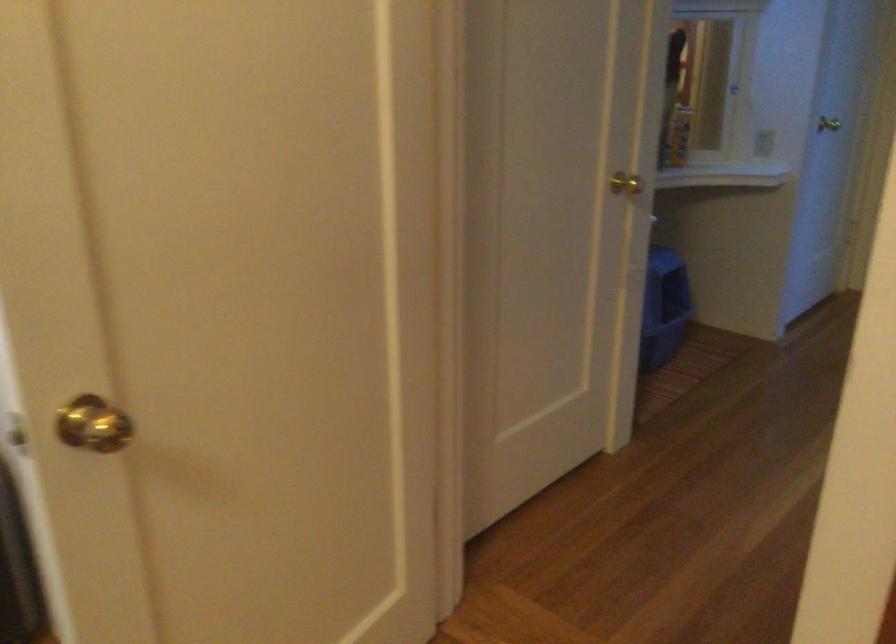
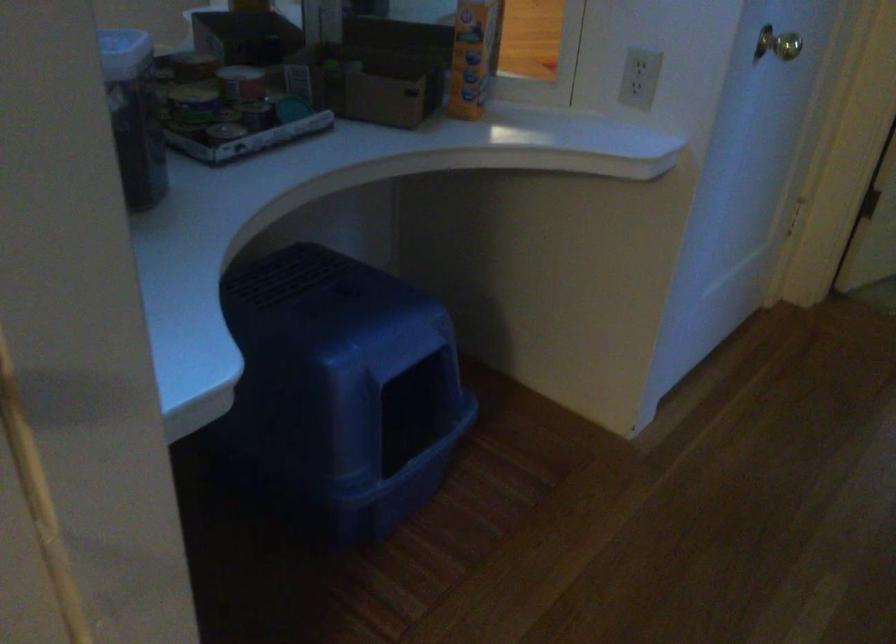
Which direction would the cameraman need to move to produce the second image?

The cameraman walked toward right, forward.